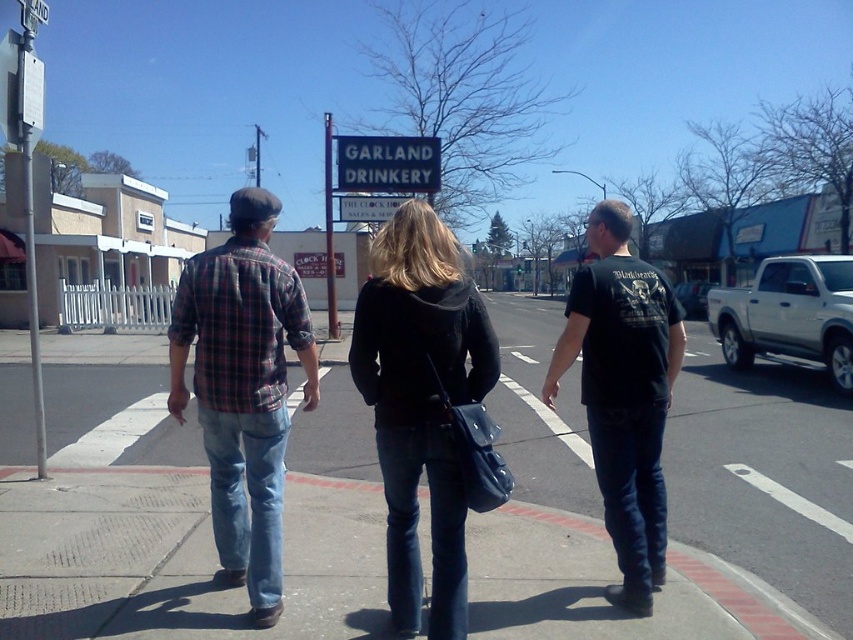
What is located at the coordinates point (x=669, y=502) in the image?

The smooth concrete sidewalk at center is located at point (x=669, y=502).